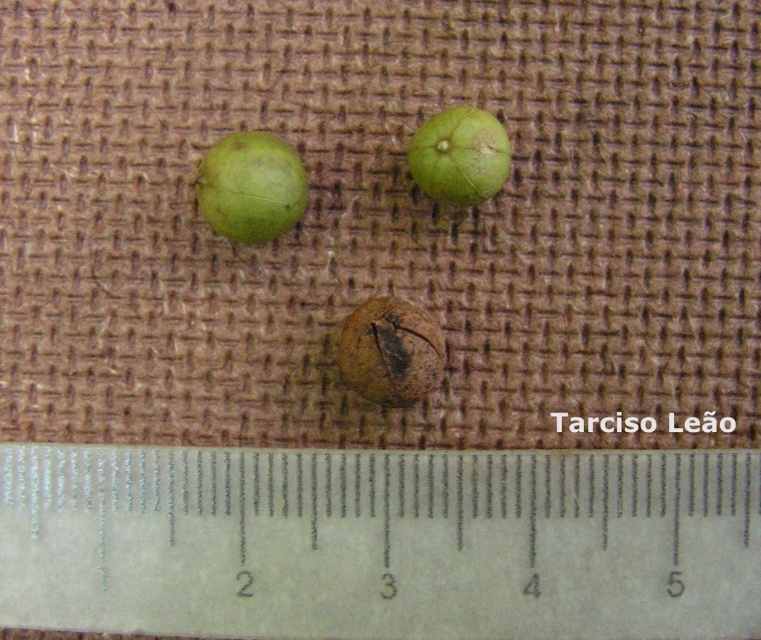
Which of these two, white plastic ruler at center or green matte seed at upper center, stands shorter?

Standing shorter between the two is green matte seed at upper center.

Between white plastic ruler at center and green matte seed at upper center, which one has more height?

Standing taller between the two is white plastic ruler at center.

Does point (65, 625) lie in front of point (438, 154)?

Yes, it is in front of point (438, 154).

Where is `white plastic ruler at center`? The width and height of the screenshot is (761, 640). white plastic ruler at center is located at coordinates (380, 541).

Which is in front, point (260, 189) or point (432, 356)?

Point (432, 356)

Is point (221, 234) farther from camera compared to point (363, 323)?

Yes, point (221, 234) is farther from viewer.

Where is `green matte sphere at upper left`? green matte sphere at upper left is located at coordinates (250, 186).

Describe the element at coordinates (250, 186) in the screenshot. I see `green matte sphere at upper left` at that location.

Is point (256, 211) positioned behind point (432, 120)?

No, it is not.

Image resolution: width=761 pixels, height=640 pixels. What are the coordinates of `green matte sphere at upper left` in the screenshot? It's located at click(x=250, y=186).